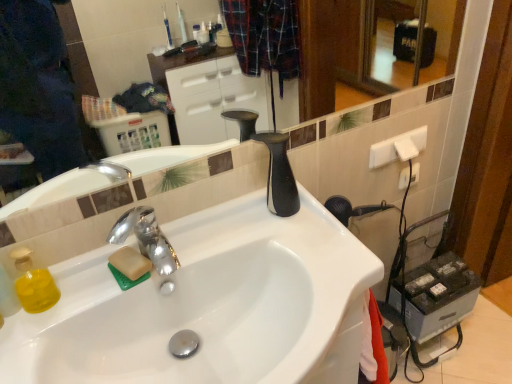
Image resolution: width=512 pixels, height=384 pixels. I want to click on vacant region to the left of chrome metallic faucet at center, so click(75, 304).